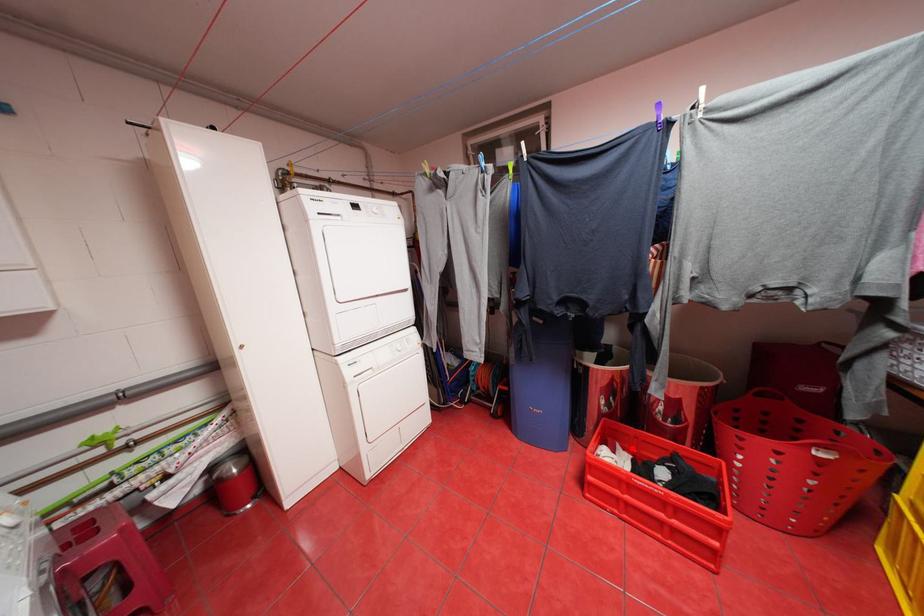
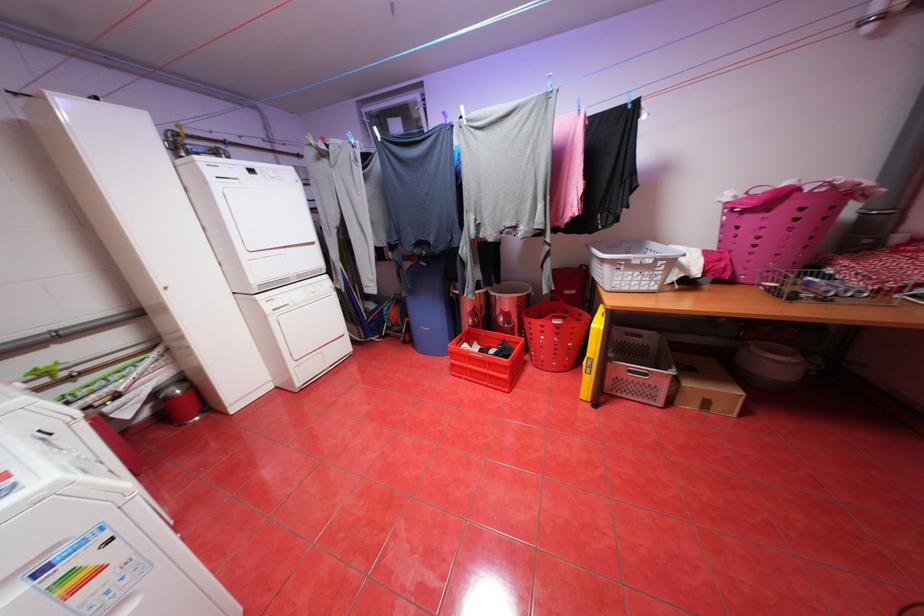
The point at the highlighted location is marked in the first image. Where is the corresponding point in the second image?

(488, 344)